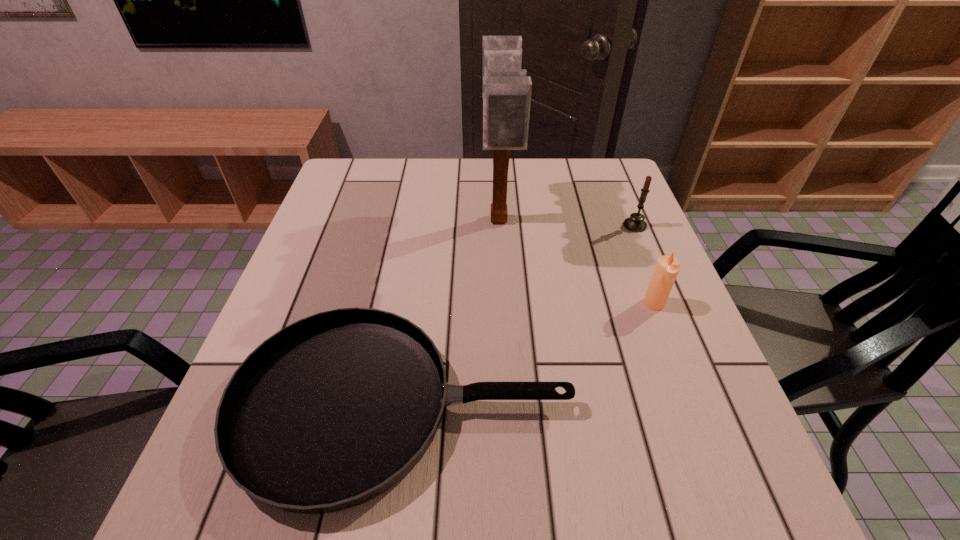
In the image, there is a desktop. Identify the location of free space at the near right corner. (752, 532).

At what (x,y) coordinates should I click in order to perform the action: click on vacant space that's between the mallet and the second nearest object. Please return your answer as a coordinate pair (x, y). This screenshot has width=960, height=540. Looking at the image, I should click on (576, 262).

Locate an element on the screen. free spot between the frying pan and the tallest object is located at coordinates (x=451, y=313).

Image resolution: width=960 pixels, height=540 pixels. I want to click on empty space that is in between the tallest object and the farther candle, so (x=566, y=224).

Where is `free space between the second nearest object and the tallest object`? free space between the second nearest object and the tallest object is located at coordinates (576, 262).

This screenshot has height=540, width=960. Find the location of `vacant area that lies between the nearer candle and the farther candle`. vacant area that lies between the nearer candle and the farther candle is located at coordinates (644, 264).

Identify the location of vacant space that is in between the farther candle and the second nearest object. (644, 264).

I want to click on free space between the farther candle and the tallest object, so click(566, 224).

This screenshot has width=960, height=540. Identify the location of unoccupied area between the farther candle and the tallest object. coord(566,224).

This screenshot has height=540, width=960. I want to click on free spot between the farther candle and the mallet, so click(566, 224).